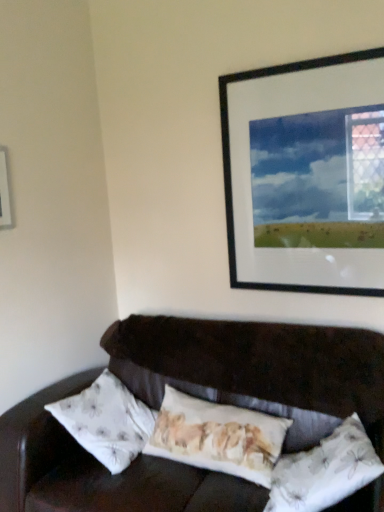
Question: In the image, is floral fabric pillow at center, which is counted as the 1th pillow, starting from the left, positioned in front of or behind white floral fabric pillow at lower right, which is the 1th pillow in right-to-left order?

Choices:
 (A) front
 (B) behind

Answer: (B)

Question: From the image's perspective, relative to white floral fabric pillow at lower right, which is the 1th pillow in right-to-left order, is floral fabric pillow at center, positioned as the 2th pillow in right-to-left order, above or below?

Choices:
 (A) below
 (B) above

Answer: (B)

Question: Considering the real-world distances, which object is farthest from the floral fabric pillow at center, which is counted as the 1th pillow, starting from the left?

Choices:
 (A) black matte picture frame at upper right, marked as the first picture frame in a right-to-left arrangement
 (B) white floral fabric pillow at lower right, the 2th pillow when ordered from left to right
 (C) white plastic picture frame at upper left, the 1th picture frame from the left

Answer: (C)

Question: Estimate the real-world distances between objects in this image. Which object is closer to the floral fabric pillow at center, which is counted as the 1th pillow, starting from the left?

Choices:
 (A) white floral fabric pillow at lower right, which is the 1th pillow in right-to-left order
 (B) black matte picture frame at upper right, marked as the first picture frame in a right-to-left arrangement
 (C) white plastic picture frame at upper left, the 1th picture frame from the left

Answer: (A)